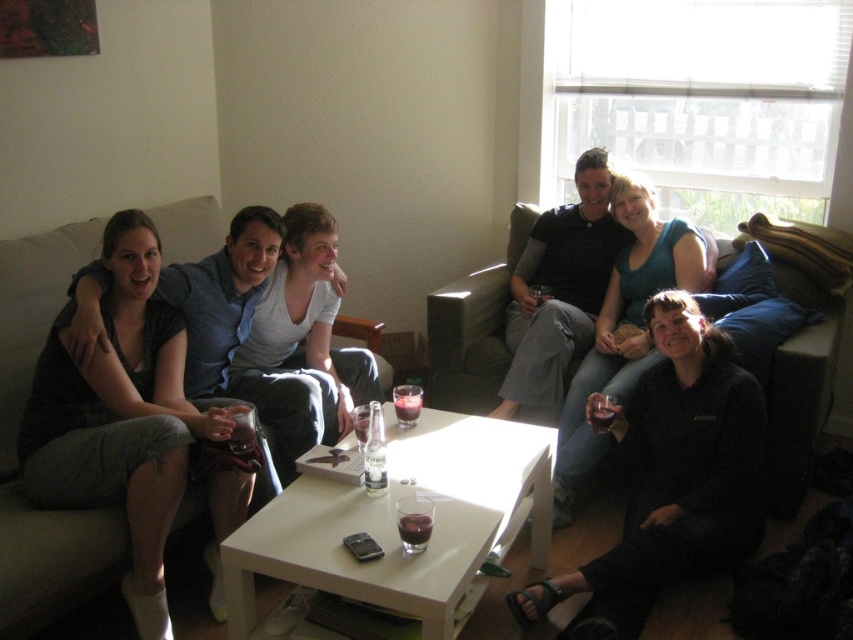
Question: Which object is positioned farthest from the translucent glass at coffee table?

Choices:
 (A) translucent glass wine at center
 (B) dark gray fabric couch at left
 (C) translucent glass at center

Answer: (B)

Question: Which object is positioned closest to the dark gray fabric couch at left?

Choices:
 (A) dark gray leather couch at center
 (B) translucent glass at coffee table
 (C) matte black shirt at center
 (D) translucent glass at center

Answer: (B)

Question: Is dark gray fabric couch at left below translucent glass wine at center?

Choices:
 (A) yes
 (B) no

Answer: (B)

Question: Which object is farther from the camera taking this photo?

Choices:
 (A) translucent glass at center
 (B) matte black shirt at center
 (C) dark gray leather couch at center

Answer: (C)

Question: Does black fleece at lower right have a greater width compared to translucent glass at center?

Choices:
 (A) yes
 (B) no

Answer: (A)

Question: Does dark gray fabric couch at left come in front of translucent glass at center?

Choices:
 (A) no
 (B) yes

Answer: (B)